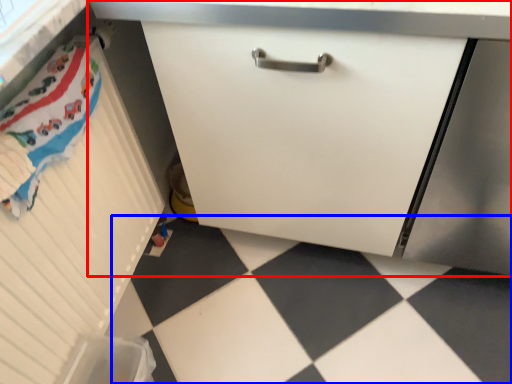
Question: Which point is closer to the camera, cabinetry (highlighted by a red box) or tile (highlighted by a blue box)?

Choices:
 (A) cabinetry
 (B) tile

Answer: (A)